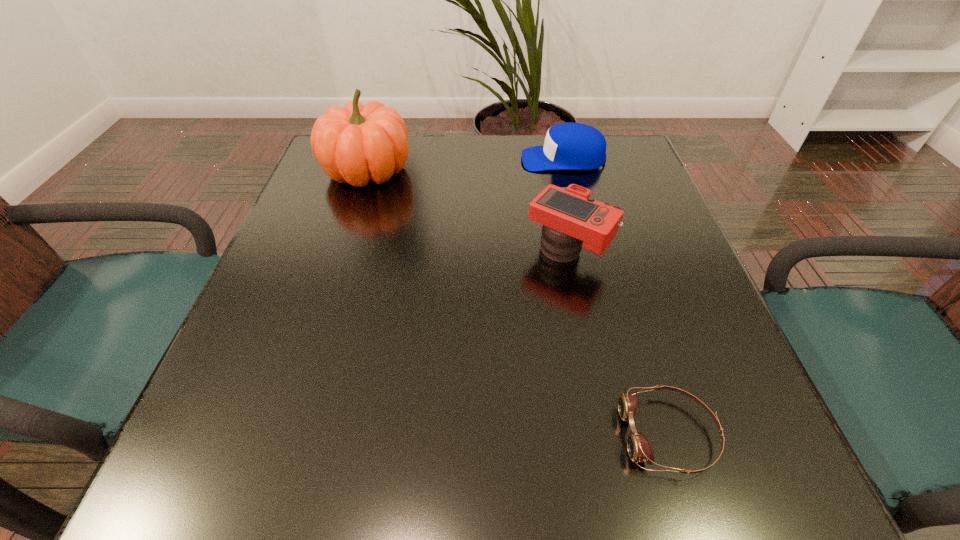
You are a GUI agent. You are given a task and a screenshot of the screen. Output one action in this format:
    pyautogui.click(x=<x>, y=<y>)
    Task: Click on the leftmost object
    
    Given the screenshot: What is the action you would take?
    pyautogui.click(x=359, y=143)

This screenshot has height=540, width=960. I want to click on pumpkin, so (x=359, y=143).

Identify the location of the third farthest object. (572, 219).

Locate an element on the screen. camera is located at coordinates (572, 219).

I want to click on the third tallest object, so click(568, 146).

The height and width of the screenshot is (540, 960). In order to click on the nearest object in this screenshot , I will do `click(639, 448)`.

The height and width of the screenshot is (540, 960). Find the location of `the shortest object`. the shortest object is located at coordinates [x=639, y=448].

The height and width of the screenshot is (540, 960). What are the coordinates of `vacant space positioned on the front of the tallest object` in the screenshot? It's located at (349, 225).

Image resolution: width=960 pixels, height=540 pixels. What are the coordinates of `free space located 0.150m on the back of the second nearest object` in the screenshot? It's located at (555, 187).

Identify the location of free spot located 0.070m on the front-facing side of the baseball cap. (493, 159).